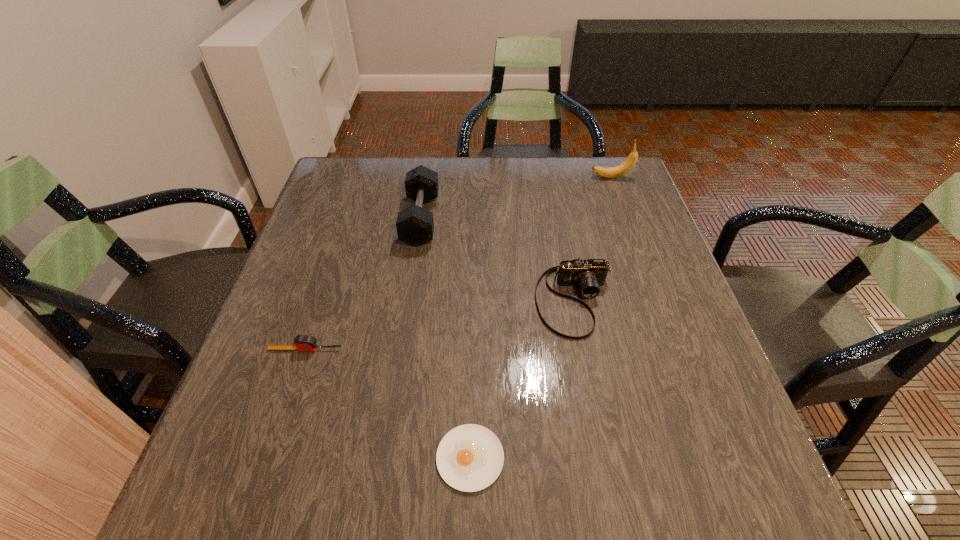
The width and height of the screenshot is (960, 540). What are the coordinates of `the farthest object` in the screenshot? It's located at (607, 172).

Locate an element on the screen. Image resolution: width=960 pixels, height=540 pixels. the rightmost object is located at coordinates (607, 172).

The image size is (960, 540). In order to click on the fourth nearest object in this screenshot , I will do `click(415, 226)`.

Locate an element on the screen. The image size is (960, 540). the fourth shortest object is located at coordinates (415, 226).

Locate an element on the screen. the third nearest object is located at coordinates (589, 274).

Find the location of `the third shortest object`. the third shortest object is located at coordinates (589, 274).

Locate an element on the screen. This screenshot has width=960, height=540. the fourth farthest object is located at coordinates (302, 342).

At what (x,y) coordinates should I click in order to perform the action: click on tape measure. Please return your answer as a coordinate pair (x, y). Looking at the image, I should click on (302, 342).

You are a GUI agent. You are given a task and a screenshot of the screen. Output one action in this format:
    pyautogui.click(x=<x>, y=<y>)
    Task: Click on the shortest object
    This screenshot has height=540, width=960.
    Given the screenshot: What is the action you would take?
    pyautogui.click(x=470, y=457)

Where is `the third object from right to left`? the third object from right to left is located at coordinates [x=470, y=457].